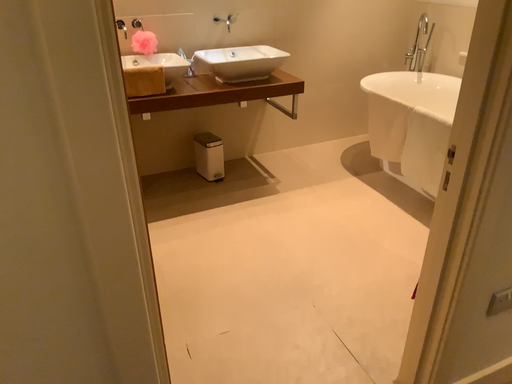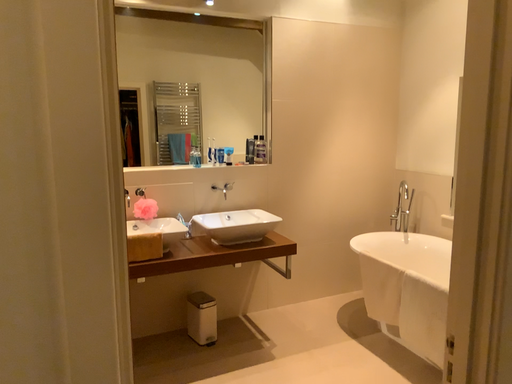
Question: How did the camera likely rotate when shooting the video?

Choices:
 (A) rotated downward
 (B) rotated upward

Answer: (B)